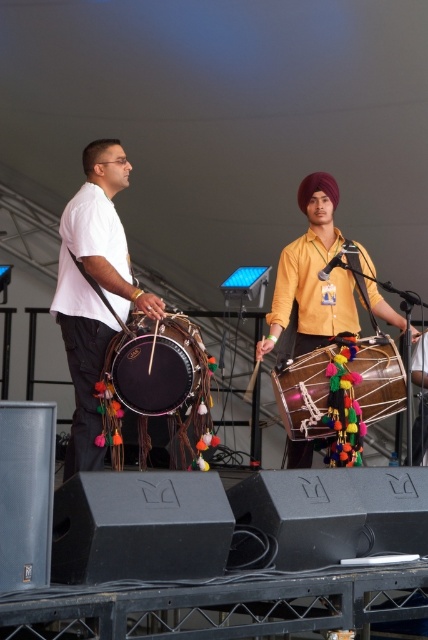
Question: Does matte black drum at center appear on the left side of multicolored fabric drum at center?

Choices:
 (A) yes
 (B) no

Answer: (A)

Question: Can you confirm if matte black drum at center is positioned below multicolored fabric drum at center?

Choices:
 (A) no
 (B) yes

Answer: (A)

Question: Based on their relative distances, which object is farther from the matte black drum at center?

Choices:
 (A) multicolored fabric drum at center
 (B) matte yellow shirt at center
 (C) matte black drum at left

Answer: (B)

Question: Which object is positioned farthest from the matte black drum at center?

Choices:
 (A) matte yellow shirt at center
 (B) matte black drum at left

Answer: (A)

Question: Among these points, which one is farthest from the camera?

Choices:
 (A) (95, 192)
 (B) (137, 344)
 (C) (299, 400)

Answer: (A)

Question: Can you confirm if matte yellow shirt at center is wider than matte black drum at center?

Choices:
 (A) no
 (B) yes

Answer: (B)